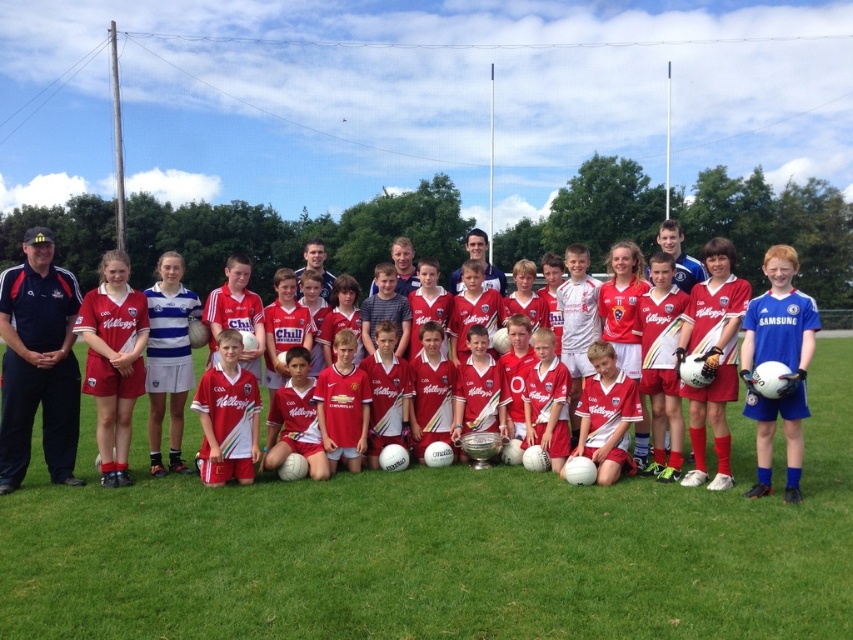
Question: Which object appears farthest from the camera in this image?

Choices:
 (A) red matte jersey at center
 (B) smooth white jersey at center

Answer: (B)

Question: Can you confirm if red matte jersey at center is positioned below dark blue uniform at left?

Choices:
 (A) no
 (B) yes

Answer: (A)

Question: Among these points, which one is nearest to the camera?

Choices:
 (A) (756, 403)
 (B) (310, 614)
 (C) (584, 406)

Answer: (B)

Question: Is dark blue uniform at left closer to the viewer compared to smooth white jersey at center?

Choices:
 (A) no
 (B) yes

Answer: (B)

Question: Among these points, which one is nearest to the camera?

Choices:
 (A) (537, 440)
 (B) (474, 232)

Answer: (A)

Question: Is blue matte football at right wider than smooth red jersey at center?

Choices:
 (A) no
 (B) yes

Answer: (B)